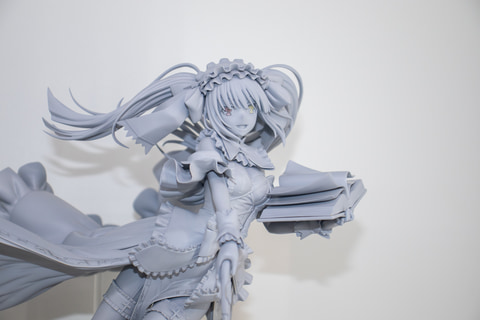
This screenshot has height=320, width=480. Identify the location of figurine. (197, 214).